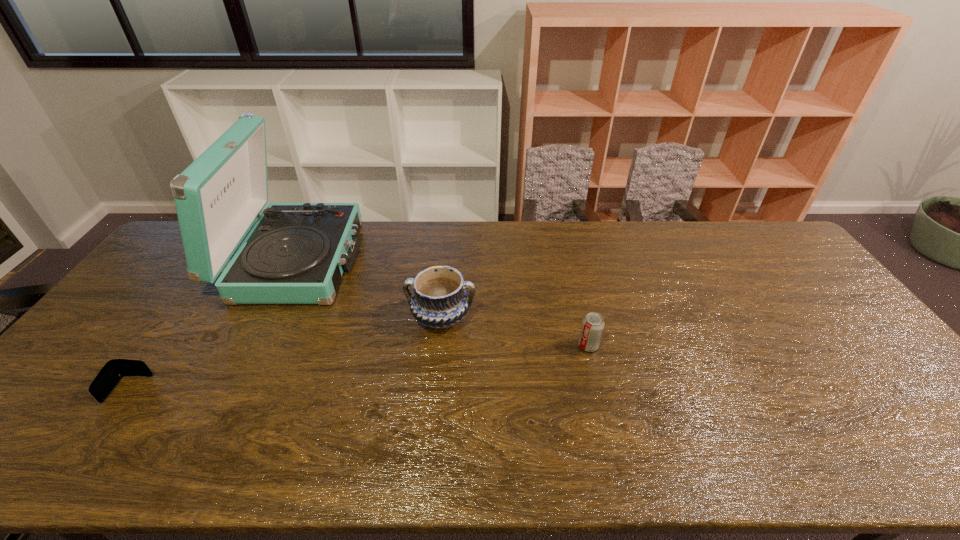
This screenshot has height=540, width=960. In order to click on free space that is in between the leftmost object and the soda can in this screenshot , I will do `click(358, 367)`.

You are a GUI agent. You are given a task and a screenshot of the screen. Output one action in this format:
    pyautogui.click(x=<x>, y=<y>)
    Task: Click on the vacant area that lies between the second object from right to left and the record player
    This screenshot has width=960, height=540.
    Given the screenshot: What is the action you would take?
    pyautogui.click(x=369, y=289)

Find the location of a particular element. Image resolution: width=960 pixels, height=540 pixels. free space between the shortest object and the record player is located at coordinates (212, 325).

Where is `free space between the pottery and the third tallest object`? Image resolution: width=960 pixels, height=540 pixels. free space between the pottery and the third tallest object is located at coordinates (515, 332).

Where is `blank region between the wallet and the third object from left to right`? blank region between the wallet and the third object from left to right is located at coordinates (285, 354).

This screenshot has width=960, height=540. I want to click on vacant space that is in between the second shortest object and the leftmost object, so click(358, 367).

Find the location of a particular element. free space that is in between the wallet and the soda can is located at coordinates [x=358, y=367].

Image resolution: width=960 pixels, height=540 pixels. In order to click on vacant point located between the record player and the shortest object in this screenshot , I will do `click(212, 325)`.

The width and height of the screenshot is (960, 540). Find the location of `empty location between the rightmost object and the leftmost object`. empty location between the rightmost object and the leftmost object is located at coordinates (358, 367).

At what (x,y) coordinates should I click in order to perform the action: click on object that ranks as the second closest to the third shortest object. Please return your answer as a coordinate pair (x, y). Looking at the image, I should click on (x=593, y=324).